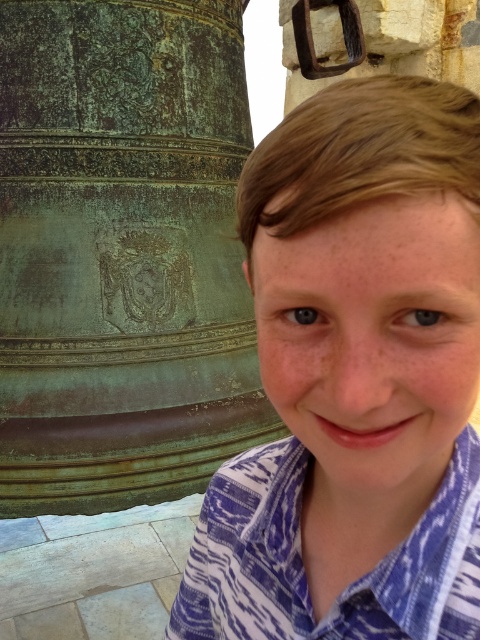
You are a photographer trying to capture the matte bronze bell at left and the blue printed shirt at right in the same frame. Based on their positions, which object should you focus on first if you want both to be in clear focus?

The matte bronze bell at left is above the blue printed shirt at right, so you should focus on the matte bronze bell at left first to ensure both are in clear focus.

You are a painter standing 2 meters away from the matte bronze bell at left and the green patina bell at left. You want to paint both bells but have only enough paint for one. Which bell is closer to you so you can decide which to paint first?

The matte bronze bell at left is closer to you at 1.34 meters away, so you should paint the matte bronze bell at left first.